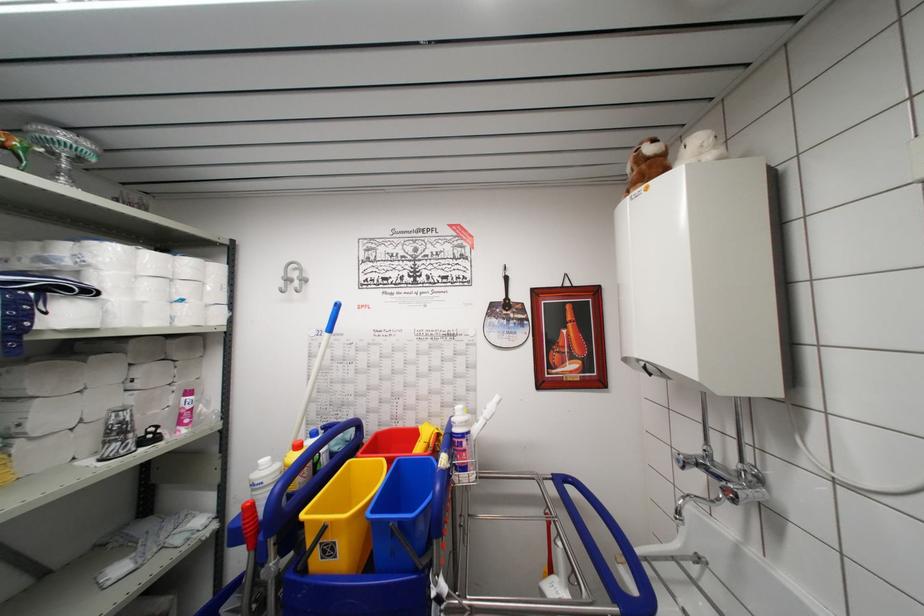
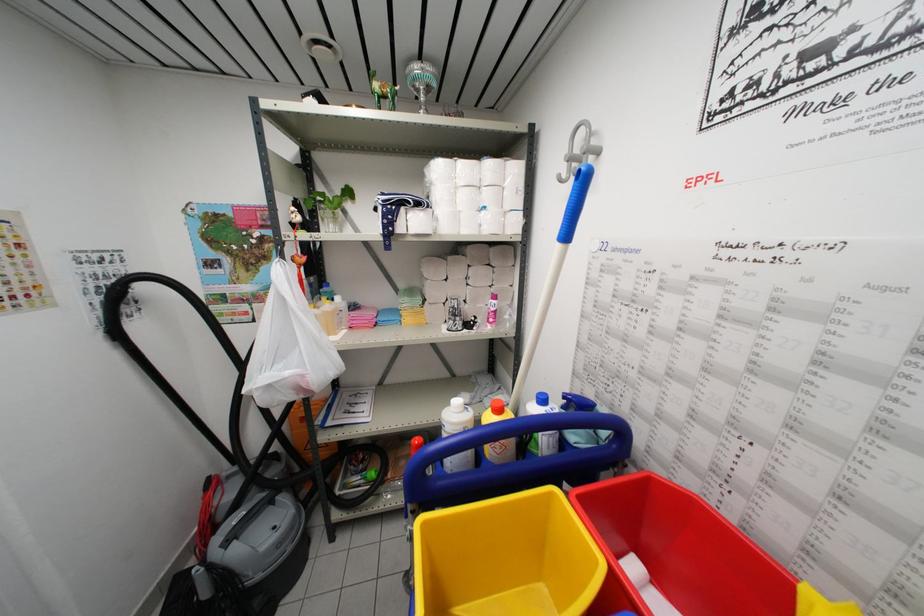
In the second image, find the point that corresponds to (x=131, y=446) in the first image.

(459, 326)